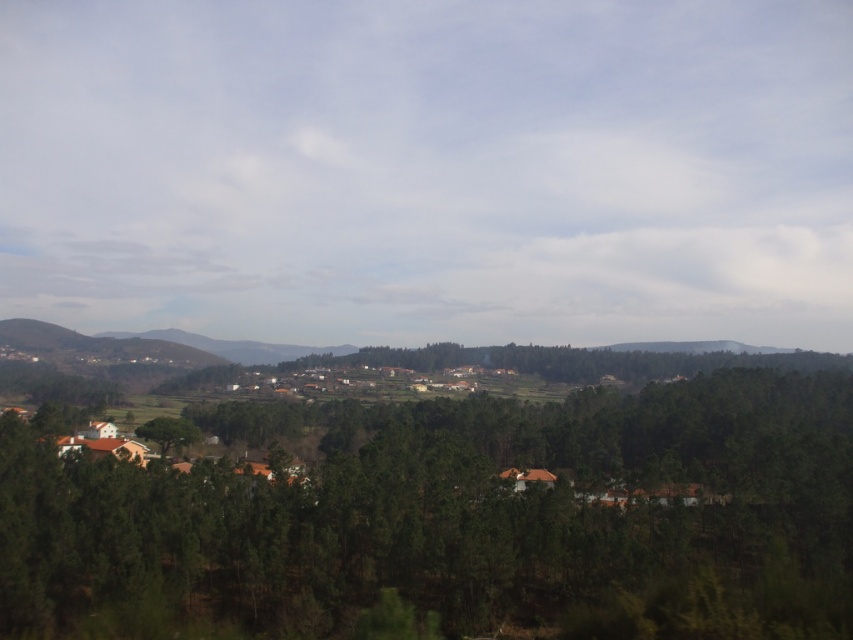
Which is above, green matte trees at center or green forested mountain at center?

Positioned higher is green forested mountain at center.

Is green matte trees at center positioned before green forested mountain at center?

That is True.

Is point (811, 435) positioned before point (190, 356)?

That is True.

Where is `green matte trees at center`? The image size is (853, 640). green matte trees at center is located at coordinates (457, 520).

Does green matte trees at center lie in front of green matte tree at center?

Yes, it is.

Looking at this image, measure the distance between green matte trees at center and camera.

The distance of green matte trees at center from camera is 6.85 meters.

Between point (848, 632) and point (190, 435), which one is positioned behind?

Point (190, 435)

Where is `green matte trees at center`? The width and height of the screenshot is (853, 640). green matte trees at center is located at coordinates (457, 520).

Can you confirm if green forested mountain at center is thinner than green matte tree at center?

In fact, green forested mountain at center might be wider than green matte tree at center.

Between green forested mountain at center and green matte tree at center, which one appears on the right side from the viewer's perspective?

From the viewer's perspective, green matte tree at center appears more on the right side.

Locate an element on the screen. green forested mountain at center is located at coordinates coord(154,342).